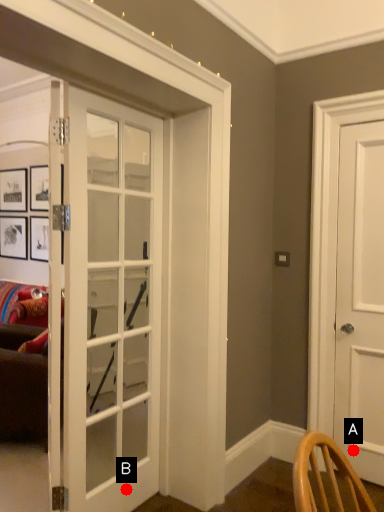
Question: Two points are circled on the image, labeled by A and B beside each circle. Which point is closer to the camera?

Choices:
 (A) A is closer
 (B) B is closer

Answer: (B)